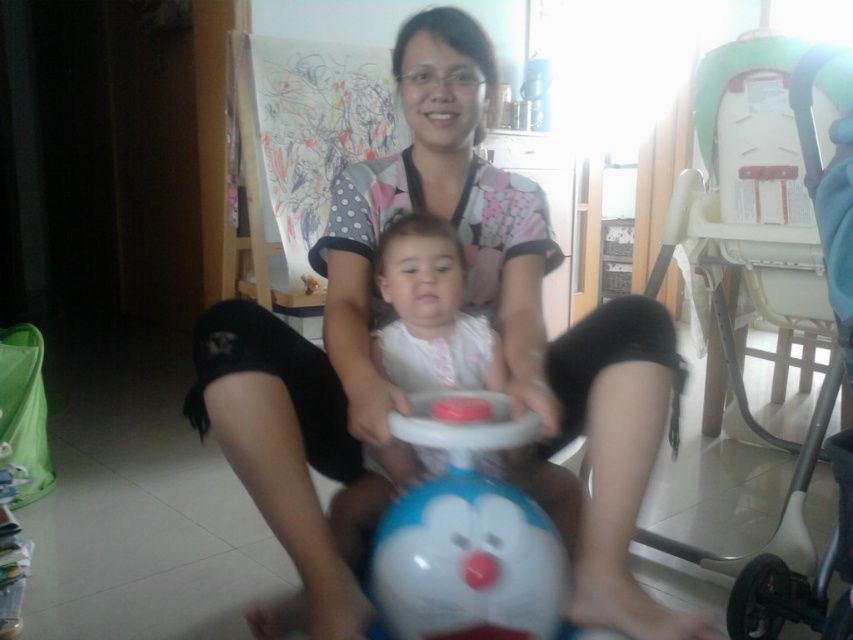
Can you confirm if matte black shorts at center is smaller than white glossy toy at center?

Actually, matte black shorts at center might be larger than white glossy toy at center.

Can you confirm if matte black shorts at center is positioned below white glossy toy at center?

No, matte black shorts at center is not below white glossy toy at center.

The image size is (853, 640). What do you see at coordinates (399, 390) in the screenshot?
I see `matte black shorts at center` at bounding box center [399, 390].

Identify the location of matte black shorts at center. The height and width of the screenshot is (640, 853). (399, 390).

Does point (828, 401) come in front of point (480, 573)?

That is False.

Locate an element on the screen. white plastic baby carriage at upper right is located at coordinates (766, 280).

Which is in front, point (782, 246) or point (519, 499)?

Positioned in front is point (519, 499).

Identify the location of white plastic baby carriage at upper right. Image resolution: width=853 pixels, height=640 pixels. (766, 280).

Does matte black shorts at center have a larger size compared to white plastic baby carriage at upper right?

No, matte black shorts at center is not bigger than white plastic baby carriage at upper right.

Which is more to the left, matte black shorts at center or white plastic baby carriage at upper right?

Positioned to the left is matte black shorts at center.

This screenshot has height=640, width=853. I want to click on matte black shorts at center, so click(399, 390).

Where is `matte black shorts at center`? matte black shorts at center is located at coordinates (399, 390).